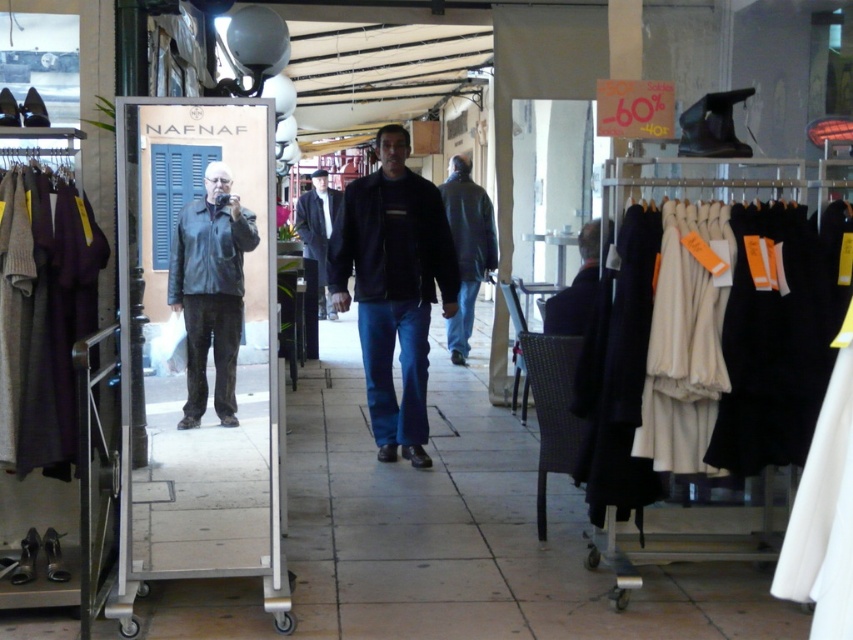
You are a customer in a clothing store. You see dark blue denim jeans at center and a leather jacket at left. Which item is positioned more to the right side of the store?

The dark blue denim jeans at center are positioned more to the right side of the store compared to the leather jacket at left.

You are a customer standing in the store and want to pick up both the dark blue denim jeans at center and the leather jacket at left. Which item should you reach for first?

You should reach for the dark blue denim jeans at center first because it is closer to you than the leather jacket at left, which is further away.

You are a customer in the store and want to compare the leather jacket at left and dark gray wool coat at center. How far apart are they?

The leather jacket at left and dark gray wool coat at center are 27.27 feet apart from each other.